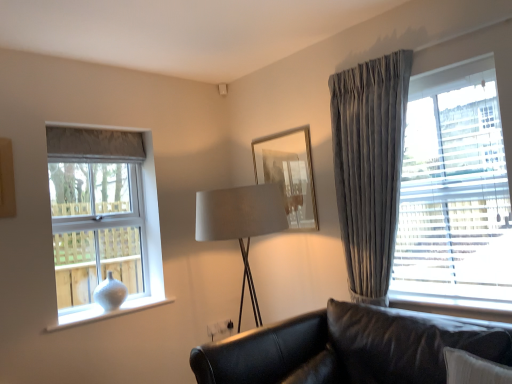
Question: Relative to velvet gray curtain at right, which is the 1th window in right-to-left order, is satin beige lampshade at center in front or behind?

Choices:
 (A) behind
 (B) front

Answer: (A)

Question: Is satin beige lampshade at center wider or thinner than velvet gray curtain at right, positioned as the second window in back-to-front order?

Choices:
 (A) thin
 (B) wide

Answer: (B)

Question: Which object is positioned closest to the white matte vase at left, which is the second window in front-to-back order?

Choices:
 (A) gold-framed mirror at center
 (B) velvet gray curtain at right, positioned as the second window in back-to-front order
 (C) black leather couch at lower right
 (D) satin grey curtain at right
 (E) white glossy vase at lower left

Answer: (E)

Question: Based on their relative distances, which object is farther from the black leather couch at lower right?

Choices:
 (A) white glossy vase at lower left
 (B) velvet gray curtain at right, the 2th window from the left
 (C) satin beige lampshade at center
 (D) white matte vase at left, positioned as the 1th window in left-to-right order
 (E) gold-framed mirror at center

Answer: (D)